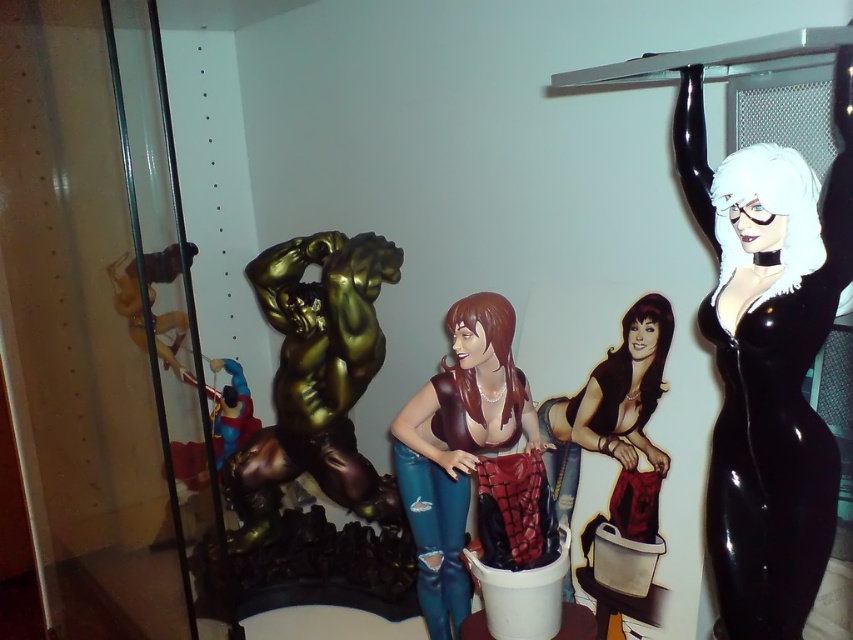
In the scene shown: Is gold metallic statue at center-left wider than matte blue plastic toy at left?

Yes.

Locate an element on the screen. The image size is (853, 640). gold metallic statue at center-left is located at coordinates (315, 380).

Describe the element at coordinates (315, 380) in the screenshot. The width and height of the screenshot is (853, 640). I see `gold metallic statue at center-left` at that location.

Locate an element on the screen. gold metallic statue at center-left is located at coordinates pyautogui.click(x=315, y=380).

Based on the photo, who is positioned more to the right, glossy black figure at upper right or matte blue plastic toy at left?

From the viewer's perspective, glossy black figure at upper right appears more on the right side.

Which is behind, point (734, 532) or point (218, 417)?

The point (218, 417) is more distant.

Identify the location of glossy black figure at upper right. (769, 358).

Is matte brown hair at center positioned behind matte black figure at center?

No, it is not.

Between point (426, 508) and point (612, 406), which one is positioned in front?

Point (612, 406) is more forward.

What are the coordinates of `matte brown hair at center` in the screenshot? It's located at (457, 448).